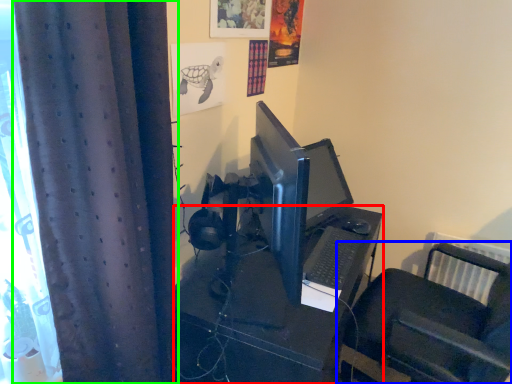
Question: Which object is positioned closest to desk (highlighted by a red box)? Select from furniture (highlighted by a blue box) and curtain (highlighted by a green box).

Choices:
 (A) furniture
 (B) curtain

Answer: (A)